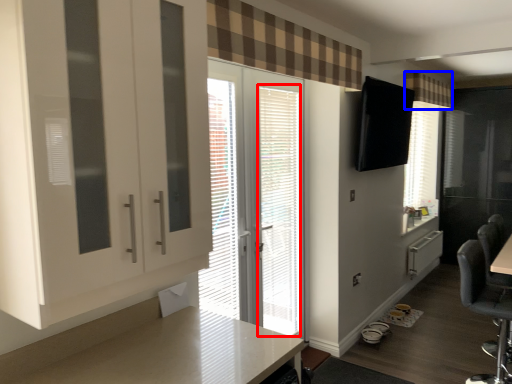
Question: Which object appears farthest to the camera in this image, blind (highlighted by a red box) or curtain (highlighted by a blue box)?

Choices:
 (A) blind
 (B) curtain

Answer: (B)